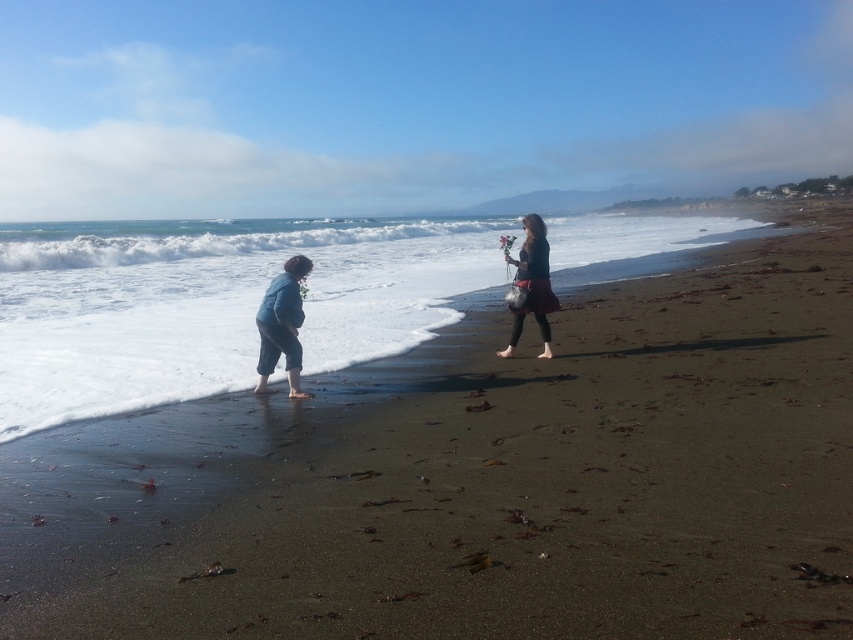
You are standing on the beach and want to place a small flag at the exact location of the point marked as point (549,483). What is the color and position of the sand at that point?

The sand at point (549,483) is dark brown and located at the lower left.

You are a photographer standing on the beach and want to capture both the person bending down near the water and the person holding flowers in your shot. You notice two points marked on your camera screen at coordinates point (494, 394) and point (547, 298). Which point should you focus on first to ensure both subjects are in clear view?

You should focus on point (494, 394) first because it is closer to the camera than point (547, 298), ensuring both subjects are in focus when using depth of field.